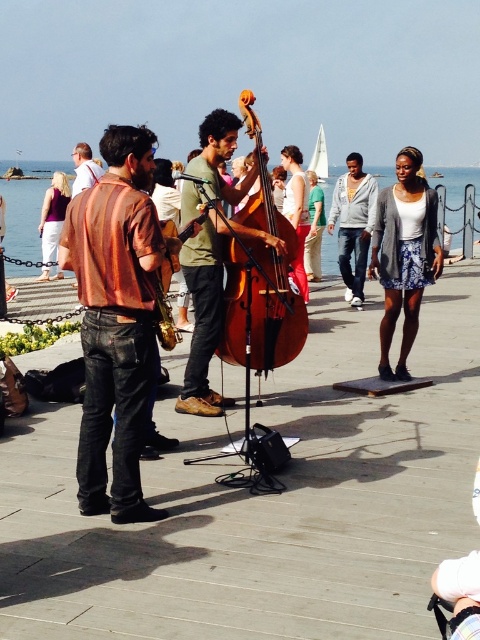
From the picture: Does matte orange shirt at center have a smaller size compared to brown wooden cello at center?

Correct, matte orange shirt at center occupies less space than brown wooden cello at center.

Does matte orange shirt at center appear under brown wooden cello at center?

Correct, matte orange shirt at center is located below brown wooden cello at center.

Which is in front, point (112, 154) or point (273, 324)?

Positioned in front is point (112, 154).

Locate an element on the screen. The width and height of the screenshot is (480, 640). matte orange shirt at center is located at coordinates (116, 320).

Can you confirm if brown wooden cello at center is shorter than green matte shirt at center?

Correct, brown wooden cello at center is not as tall as green matte shirt at center.

Who is more distant from viewer, (229,349) or (204,410)?

The point (229,349) is behind.

Locate an element on the screen. This screenshot has width=480, height=640. brown wooden cello at center is located at coordinates (261, 276).

Describe the element at coordinates (116, 320) in the screenshot. I see `matte orange shirt at center` at that location.

Who is more forward, [116,232] or [73,161]?

Point [116,232] is in front.

At what (x,y) coordinates should I click in order to perform the action: click on matte orange shirt at center. Please return your answer as a coordinate pair (x, y). The image size is (480, 640). Looking at the image, I should click on (116, 320).